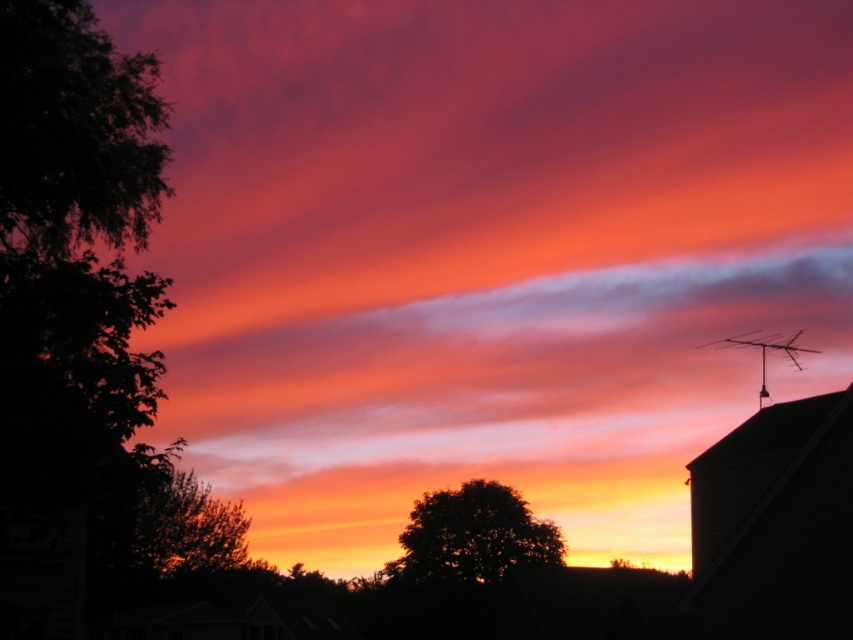
You are an artist painting the sunset scene. You want to paint the dark green leafy tree at left and the silky orange tree at center. Which tree should you paint first to ensure proper layering?

You should paint the dark green leafy tree at left first because it is in front of the silky orange tree at center, so painting it first will create the correct layered effect.

In the scene shown: You are standing in the sunset scene and want to walk from the point at the lower left corner to the point at the lower right corner. Which direction should you move to go from point (143,97) to point (186,536)?

To move from point (143,97) to point (186,536), you should move towards the right since point (186,536) is located to the right of point (143,97).